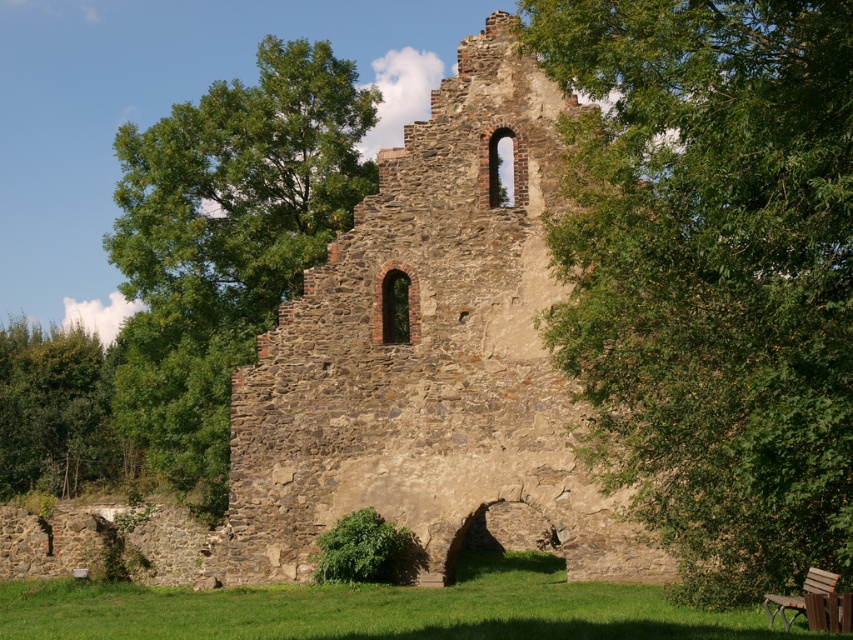
Find the location of a particular element. The width and height of the screenshot is (853, 640). green leafy tree at center is located at coordinates (711, 275).

Does green leafy tree at center have a lesser width compared to green leafy tree at left?

Yes.

Identify the location of green leafy tree at center. (711, 275).

Can you confirm if green leafy tree at center is taller than wooden bench at lower right?

Yes, green leafy tree at center is taller than wooden bench at lower right.

Based on the photo, is green leafy tree at center thinner than wooden bench at lower right?

In fact, green leafy tree at center might be wider than wooden bench at lower right.

The image size is (853, 640). What do you see at coordinates (711, 275) in the screenshot? I see `green leafy tree at center` at bounding box center [711, 275].

Identify the location of green leafy tree at center. (711, 275).

Does green leafy tree at center appear under green leafy tree at upper left?

Yes.

Can you confirm if green leafy tree at center is thinner than green leafy tree at upper left?

Yes.

What do you see at coordinates (711, 275) in the screenshot?
I see `green leafy tree at center` at bounding box center [711, 275].

Find the location of a particular element. This screenshot has height=640, width=853. green leafy tree at center is located at coordinates (711, 275).